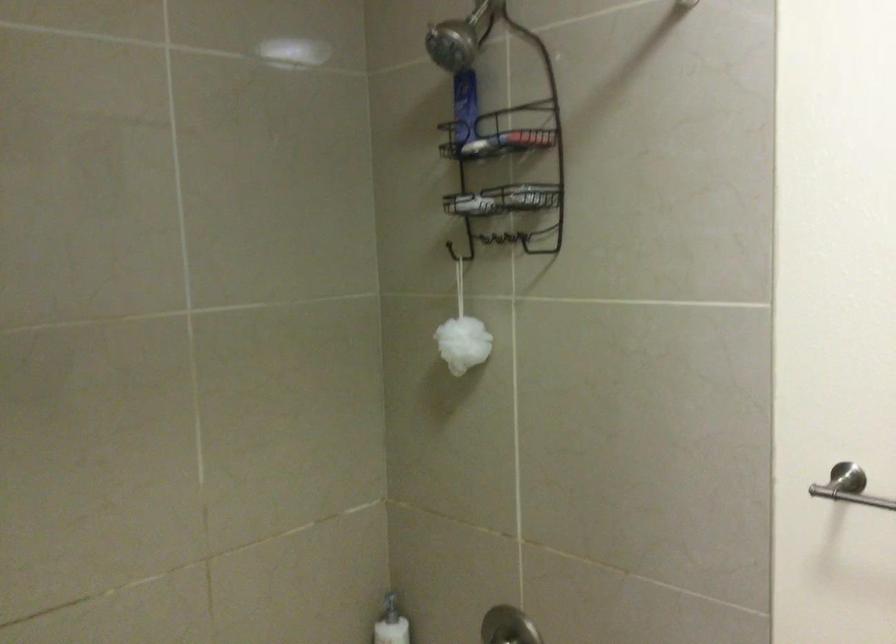
Where is `white mesh loofah`? white mesh loofah is located at coordinates (462, 343).